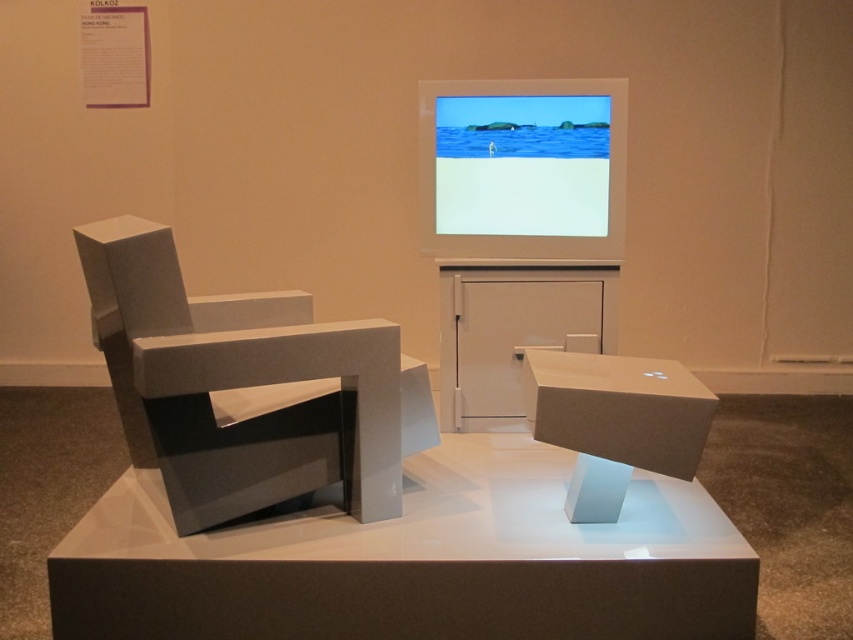
You are an art curator standing in front of the matte gray armchair at left. You want to check the content displayed on the matte plastic screen at upper center. Can you reach it without moving from your current position?

The matte gray armchair at left is 97.40 centimeters away from the matte plastic screen at upper center. Since the distance is relatively short, you can likely reach the matte plastic screen at upper center without needing to move from your current position in front of the matte gray armchair at left.

You are an art curator planning to move the matte plastic screen at upper center and the white cardboard box at center to a new gallery. The new space has a height restriction of 1.5 meters. Based on their sizes, can both items be moved without any modifications?

The matte plastic screen at upper center is much taller than the white cardboard box at center. Since the screen is taller, it might exceed the 1.5 meters height restriction. Therefore, only the white cardboard box at center can be moved without modifications, and the screen may need adjustments.

You are an art curator assessing the installation. You need to determine if the matte plastic screen at upper center can be placed on top of the white cardboard box at center without exceeding its edges. Can it fit based on their sizes?

The matte plastic screen at upper center is wider than the white cardboard box at center, so placing it on top would cause it to extend beyond the box edges.